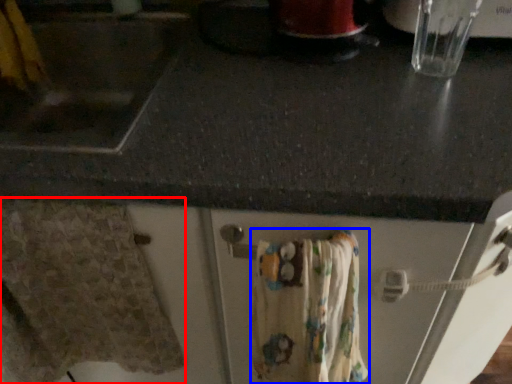
Question: Which point is further to the camera, bath towel (highlighted by a red box) or bath towel (highlighted by a blue box)?

Choices:
 (A) bath towel
 (B) bath towel

Answer: (A)